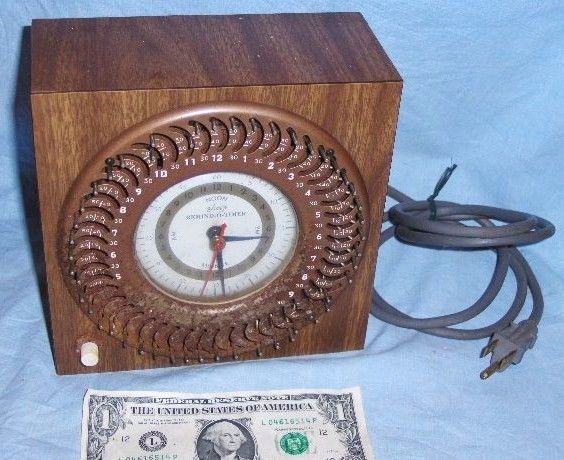
Locate an element on the screen. Image resolution: width=564 pixels, height=460 pixels. glass pane is located at coordinates [248, 213].